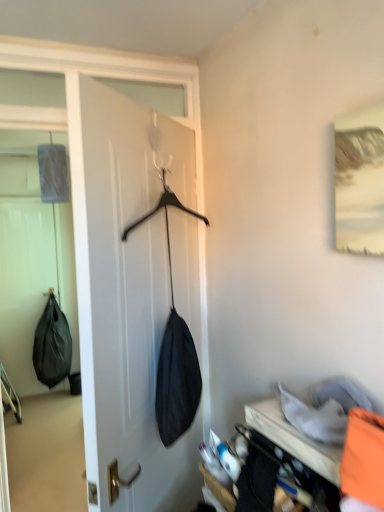
Question: Looking at the image, does orange fabric pillow at lower right seem bigger or smaller compared to black matte coat hanger at center?

Choices:
 (A) small
 (B) big

Answer: (A)

Question: In the image, is orange fabric pillow at lower right on the left side or the right side of black matte coat hanger at center?

Choices:
 (A) right
 (B) left

Answer: (A)

Question: Based on their relative distances, which object is farther from the orange fabric pillow at lower right?

Choices:
 (A) black matte coat hanger at center
 (B) orange fabric at lower right
 (C) orange fabric bag at lower right
 (D) black matte shoulder bag at left

Answer: (D)

Question: Which object is the closest to the black matte shoulder bag at left?

Choices:
 (A) orange fabric pillow at lower right
 (B) orange fabric at lower right
 (C) black matte coat hanger at center
 (D) orange fabric bag at lower right

Answer: (C)